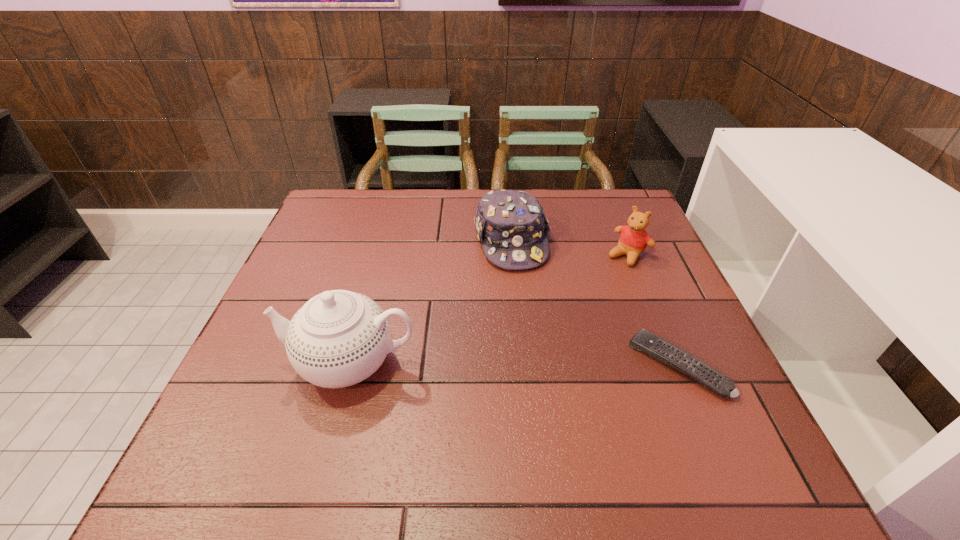
What are the coordinates of `blank space located 0.280m on the front-facing side of the teddy bear` in the screenshot? It's located at (559, 324).

Locate an element on the screen. The image size is (960, 540). free region located 0.140m on the front-facing side of the teddy bear is located at coordinates (590, 292).

At what (x,y) coordinates should I click in order to perform the action: click on vacant space located 0.250m on the front-facing side of the teddy bear. Please return your answer as a coordinate pair (x, y). Looking at the image, I should click on (566, 317).

The image size is (960, 540). Identify the location of object that is at the far edge. (511, 225).

Locate an element on the screen. This screenshot has height=540, width=960. chinaware at the near edge is located at coordinates (339, 338).

This screenshot has height=540, width=960. In order to click on remote control positioned at the near edge in this screenshot , I will do pos(658,348).

Find the location of a particular element. This screenshot has height=540, width=960. object situated at the left edge is located at coordinates (339, 338).

Find the location of a particular element. The height and width of the screenshot is (540, 960). remote control at the right edge is located at coordinates (658, 348).

You are a GUI agent. You are given a task and a screenshot of the screen. Output one action in this format:
    pyautogui.click(x=<x>, y=<y>)
    Task: Click on the teddy bear that is positioned at the right edge
    The image size is (960, 540).
    Given the screenshot: What is the action you would take?
    pyautogui.click(x=634, y=239)

Locate an element on the screen. This screenshot has width=960, height=540. object positioned at the near left corner is located at coordinates (339, 338).